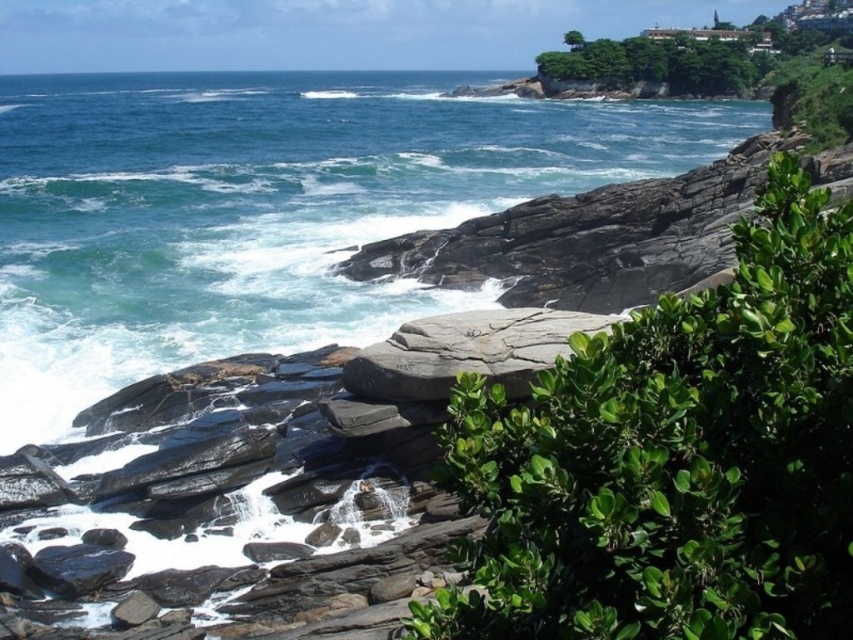
You are standing on the beach and see the blue water at upper left and the gray rock at center. Which object is closer to your left side?

The blue water at upper left is closer to your left side because it is positioned to the left of the gray rock at center.

You are a hiker standing on the gray rock at center and want to reach the blue water at upper left. Which direction should you move to get there?

To reach the blue water at upper left from the gray rock at center, you should move upward because the blue water at upper left is located above the gray rock at center.

From the picture: You are a drone operator tasked with capturing aerial footage of the coastal scene. Your drone has a maximum flight range of 200 feet. If you are positioned at the blue water at upper left, can you fly your drone to the gray rock at center without exceeding its range?

The blue water at upper left and gray rock at center are 219.39 feet apart from each other. Since the drone has a maximum range of 200 feet, it cannot reach the gray rock at center from the blue water at upper left without exceeding its range.